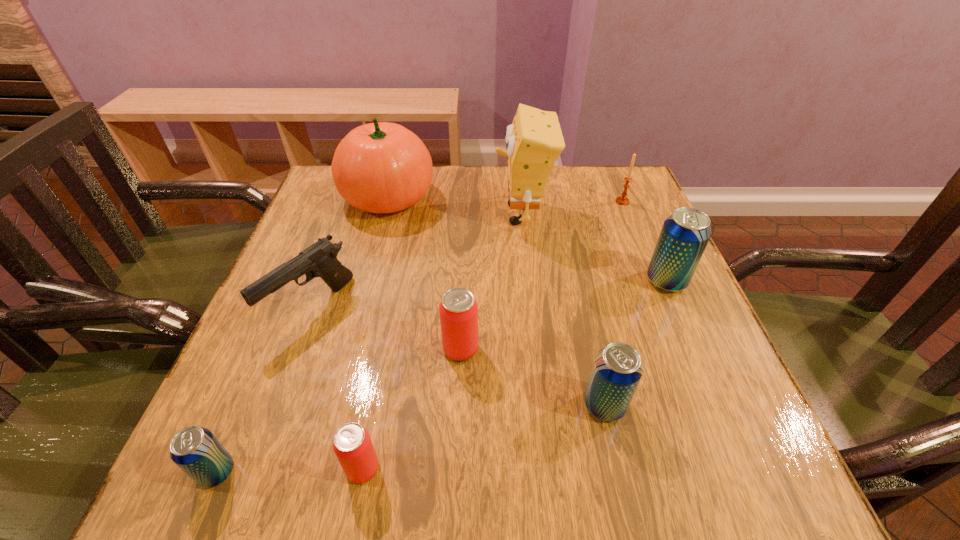
The height and width of the screenshot is (540, 960). I want to click on free space at the near left corner of the desktop, so click(303, 438).

Identify the location of vacant space at the near right corner. Image resolution: width=960 pixels, height=540 pixels. (739, 473).

Locate an element on the screen. The width and height of the screenshot is (960, 540). blank region between the bigger red beer can and the sponge is located at coordinates (492, 281).

The height and width of the screenshot is (540, 960). Find the location of `unoccupied position between the second farthest blue beer can and the fifth object from right to left`. unoccupied position between the second farthest blue beer can and the fifth object from right to left is located at coordinates (533, 377).

You are a GUI agent. You are given a task and a screenshot of the screen. Output one action in this format:
    pyautogui.click(x=<x>, y=<y>)
    Task: Click on the free space between the candle_holder and the left red beer can
    
    Given the screenshot: What is the action you would take?
    pyautogui.click(x=492, y=335)

Identify the location of vacant space in between the second beer can from right to left and the yellow sponge. (564, 309).

Where is `blank region between the candle_holder and the black gun`? The width and height of the screenshot is (960, 540). blank region between the candle_holder and the black gun is located at coordinates (467, 254).

Find the location of a particular element. vacant point located between the fourth nearest beer can and the seventh shortest object is located at coordinates (564, 315).

What are the coordinates of `empty space that is in between the yellow sponge and the farthest beer can` in the screenshot? It's located at (594, 247).

This screenshot has width=960, height=540. Identify the location of vacant space that is in between the eighth shortest object and the tallest beer can. (527, 239).